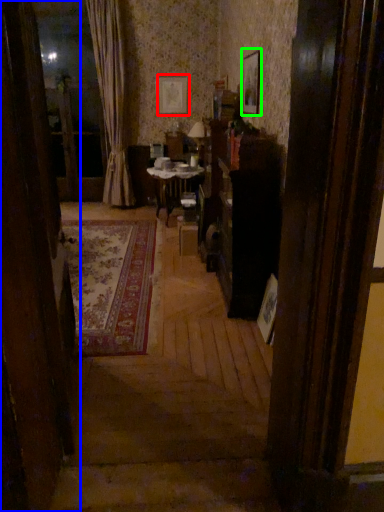
Question: Considering the real-world distances, which object is closest to picture frame (highlighted by a red box)? furniture (highlighted by a blue box) or picture frame (highlighted by a green box).

Choices:
 (A) furniture
 (B) picture frame

Answer: (B)